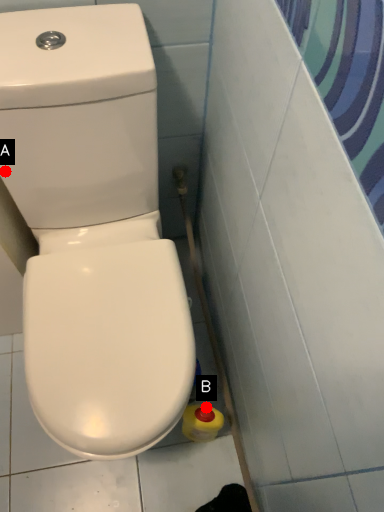
Question: Two points are circled on the image, labeled by A and B beside each circle. Which point appears farthest from the camera in this image?

Choices:
 (A) A is further
 (B) B is further

Answer: (B)